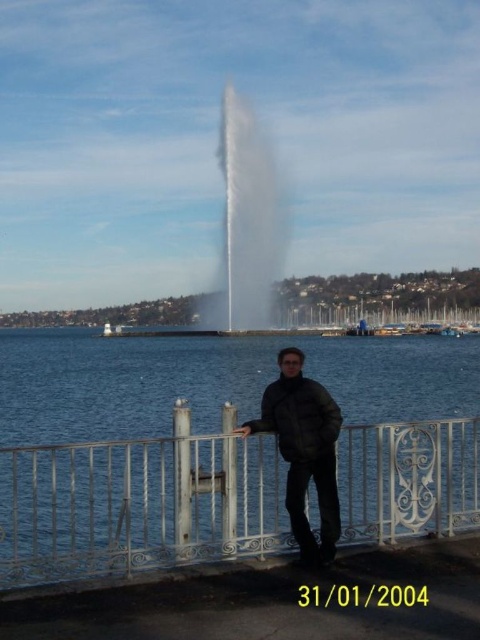
You are standing at the point marked by the coordinates point (139, 504) in the image. What object are you currently standing on?

The coordinates point (139, 504) marks the white wrought iron fence at lower center, so you are standing on the white wrought iron fence at lower center.

Looking at this image, you are a photographer trying to capture the white frothy water at center and the black matte jacket at center in the same frame. Which object should you zoom in on to ensure both are visible without cropping?

The white frothy water at center has a larger size compared to black matte jacket at center, so you should zoom in on the white frothy water at center to ensure both are visible without cropping.

You are standing at the position of the man in the scene. If you want to walk towards the tall fountain in the middle distance, which direction should you move relative to the white wrought iron fence at lower center?

To reach the tall fountain in the middle distance, you should move away from the white wrought iron fence at lower center since the fountain is located across the water in the middle distance, while the fence is in the foreground at your current position.